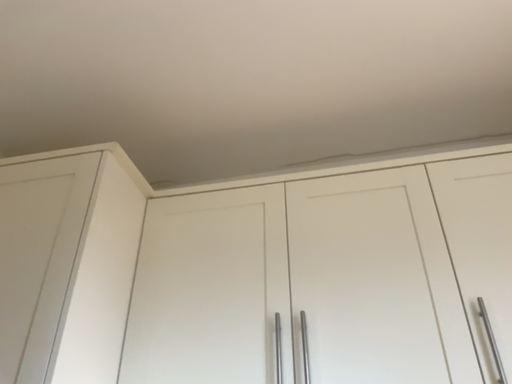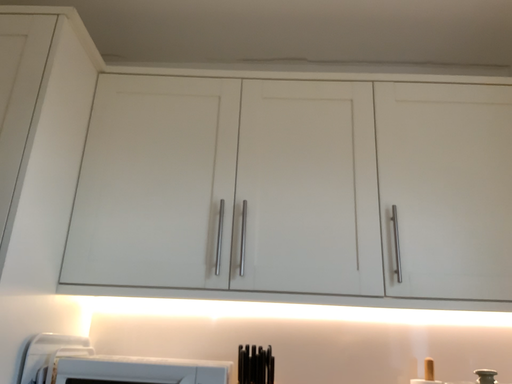
Question: Which way did the camera rotate in the video?

Choices:
 (A) rotated upward
 (B) rotated downward

Answer: (B)